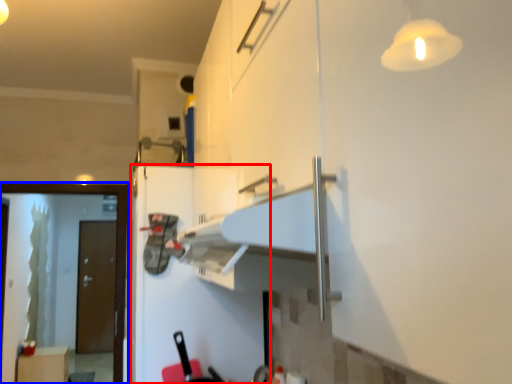
Question: Which of the following is the closest to the observer, fridge (highlighted by a red box) or screen door (highlighted by a blue box)?

Choices:
 (A) fridge
 (B) screen door

Answer: (A)